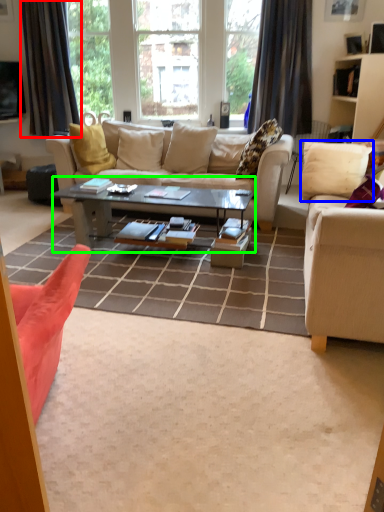
Question: Considering the real-world distances, which object is farthest from curtain (highlighted by a red box)? pillow (highlighted by a blue box) or coffee table (highlighted by a green box)?

Choices:
 (A) pillow
 (B) coffee table

Answer: (A)